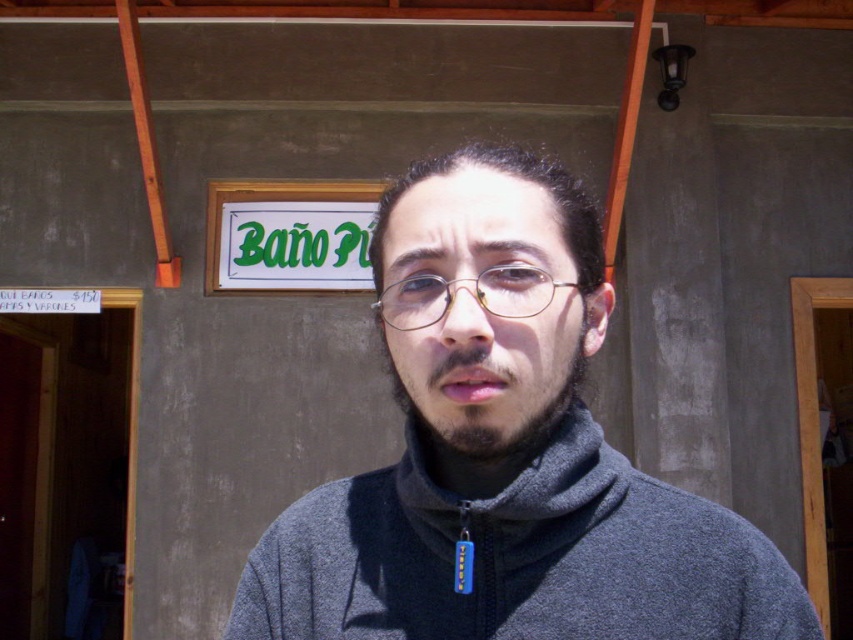
Looking at this image, you are a photographer trying to capture the person in the image. You want to focus on the gray fleece jacket at center and dark brown stubble at center. Which object should you adjust your camera to focus on first if you want to start with the one closer to the left side?

The dark brown stubble at center is on the left side of the gray fleece jacket at center, so you should focus on the dark brown stubble at center first since it is closer to the left side.

You are a delivery person who needs to deliver a package to the public restroom marked by the sign. You are currently standing at the center of the image where the gray fleece jacket at center is located. The package must be placed at the entrance of the restroom. Which direction should you move relative to your current position to reach the entrance?

Since the gray fleece jacket at center is located at point (x=503, y=452) in the image, you should move towards the left to reach the entrance of the restroom marked by the sign on the building.